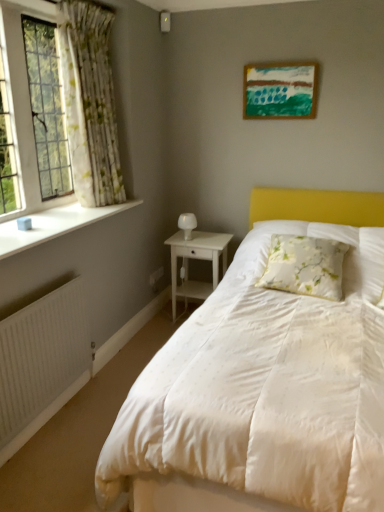
Question: From a real-world perspective, is wooden painted picture frame at upper center above or below white wood nightstand at center?

Choices:
 (A) above
 (B) below

Answer: (A)

Question: Considering the positions of wooden painted picture frame at upper center and white wood nightstand at center in the image, is wooden painted picture frame at upper center wider or thinner than white wood nightstand at center?

Choices:
 (A) thin
 (B) wide

Answer: (A)

Question: Estimate the real-world distances between objects in this image. Which object is closer to the floral fabric pillow at center?

Choices:
 (A) white floral fabric curtain at left
 (B) white glossy table lamp at center
 (C) white wood nightstand at center
 (D) white ribbed radiator at lower left
 (E) clear glass window at left

Answer: (C)

Question: Estimate the real-world distances between objects in this image. Which object is farther from the white wood nightstand at center?

Choices:
 (A) clear glass window at left
 (B) floral fabric pillow at center
 (C) white smooth window sill at left
 (D) wooden painted picture frame at upper center
 (E) white ribbed radiator at lower left

Answer: (E)